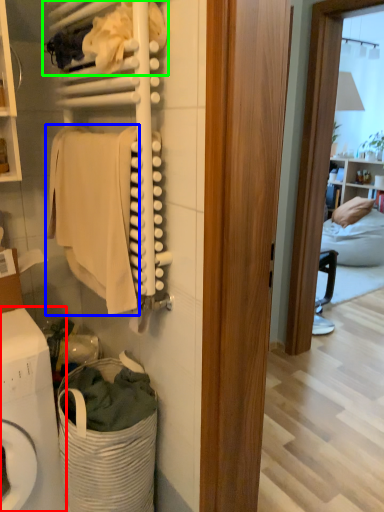
Question: Which is farther away from washing machine (highlighted by a red box)? clothing (highlighted by a blue box) or laundry (highlighted by a green box)?

Choices:
 (A) clothing
 (B) laundry

Answer: (B)